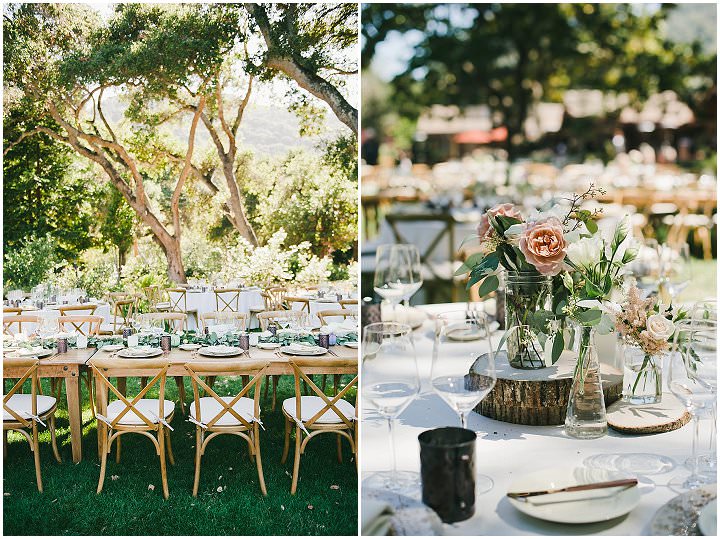
If there are any where you'd sit present in the image, indicate their positions. Your answer should be formatted as a list of tuples, i.e. [(x1, y1), (x2, y2), ...], where each tuple contains the x and y coordinates of a point satisfying the conditions above.

[(309, 403)]